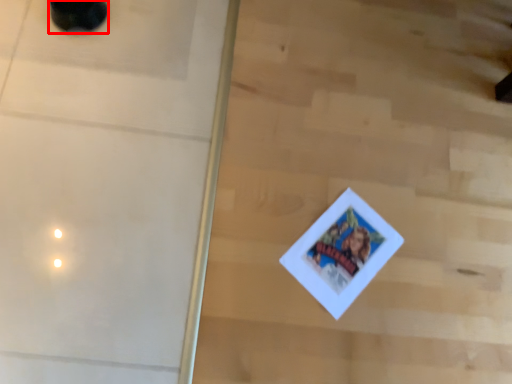
Question: Where is footwear (annotated by the red box) located in relation to screen door in the image?

Choices:
 (A) left
 (B) right

Answer: (A)